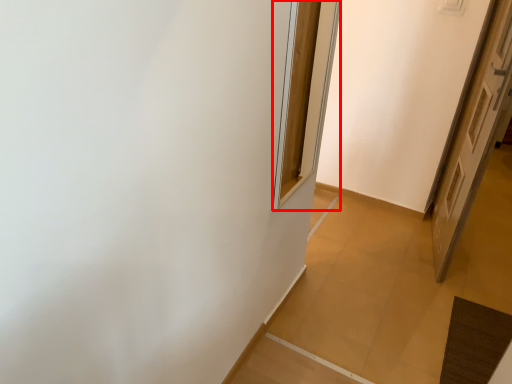
Question: From the image, what is the correct spatial relationship of window (annotated by the red box) in relation to door?

Choices:
 (A) right
 (B) left

Answer: (B)